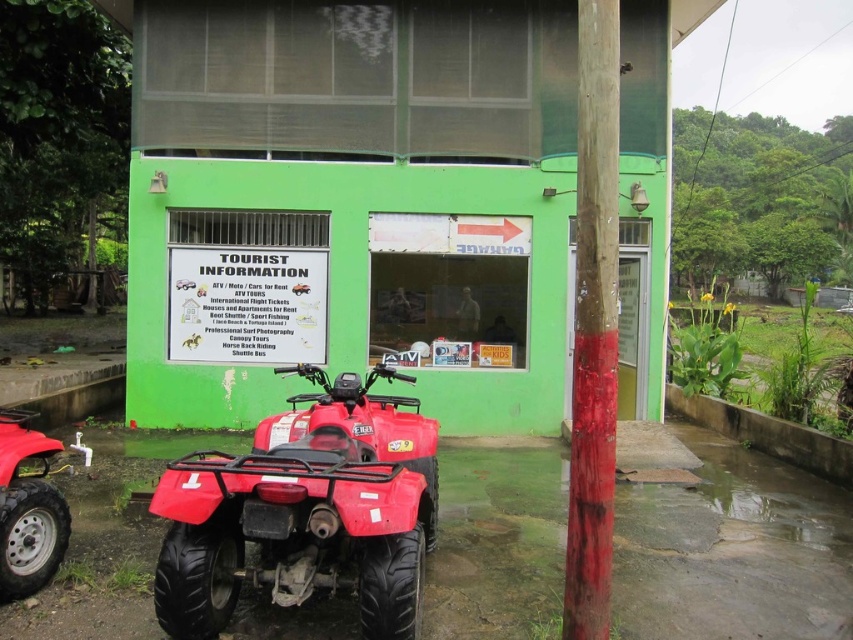
You are standing at point (431, 428) and want to reach the TOURIST INFORMATION building. The red arrow points to the right. If you walk towards the direction the red arrow is pointing, will you get closer to the building?

The red arrow points to the right, but since you are already at point (431, 428) and the building is in front of you, walking in the direction of the arrow may not necessarily get you closer. However, without knowing the exact layout, it is difficult to determine the exact path. The distance between you and the building is 17.06 feet, so you need to ensure your path leads towards reducing that distance.

You are standing in front of the TOURIST INFORMATION building and want to locate the shiny red quad bike at lower left and the smooth wooden pole at right. Which object is closer to you?

The shiny red quad bike at lower left is closer to you because the smooth wooden pole at right is behind it.